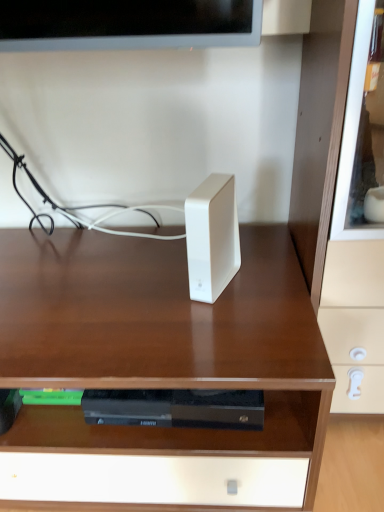
Question: Does white matte ipod at center appear on the right side of white glossy speaker at center?

Choices:
 (A) yes
 (B) no

Answer: (A)

Question: Does white matte ipod at center have a lesser width compared to white glossy speaker at center?

Choices:
 (A) no
 (B) yes

Answer: (B)

Question: Are white matte ipod at center and white glossy speaker at center far apart?

Choices:
 (A) no
 (B) yes

Answer: (A)

Question: Considering the relative positions of white matte ipod at center and white glossy speaker at center in the image provided, is white matte ipod at center to the left of white glossy speaker at center from the viewer's perspective?

Choices:
 (A) no
 (B) yes

Answer: (A)

Question: Is white matte ipod at center located outside white glossy speaker at center?

Choices:
 (A) yes
 (B) no

Answer: (A)

Question: From the image's perspective, is white matte ipod at center below white glossy speaker at center?

Choices:
 (A) no
 (B) yes

Answer: (A)

Question: From a real-world perspective, is white glossy speaker at center positioned over white matte ipod at center based on gravity?

Choices:
 (A) no
 (B) yes

Answer: (A)

Question: Is white glossy speaker at center at the left side of white matte ipod at center?

Choices:
 (A) no
 (B) yes

Answer: (B)

Question: Is white matte ipod at center inside white glossy speaker at center?

Choices:
 (A) yes
 (B) no

Answer: (B)

Question: Is the position of white glossy speaker at center less distant than that of white matte ipod at center?

Choices:
 (A) no
 (B) yes

Answer: (B)

Question: Does white glossy speaker at center have a lesser height compared to white matte ipod at center?

Choices:
 (A) yes
 (B) no

Answer: (B)

Question: Is white glossy speaker at center oriented away from white matte ipod at center?

Choices:
 (A) yes
 (B) no

Answer: (B)

Question: Can you confirm if white glossy speaker at center is positioned to the right of matte white drawer at right?

Choices:
 (A) yes
 (B) no

Answer: (B)